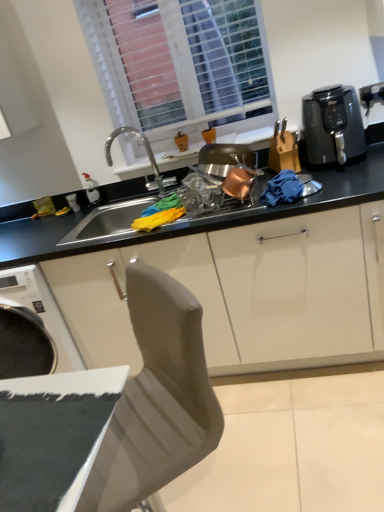
The height and width of the screenshot is (512, 384). In order to click on black plastic air fryer at upper right in this screenshot , I will do `click(332, 126)`.

Find the location of `black matte countertop at center`. black matte countertop at center is located at coordinates (194, 216).

The width and height of the screenshot is (384, 512). I want to click on white plastic window at upper center, so click(x=181, y=63).

Is white plastic window at upper center further to the viewer compared to black plastic air fryer at upper right?

That is True.

How many degrees apart are the facing directions of white plastic window at upper center and black plastic air fryer at upper right?

The angular difference between white plastic window at upper center and black plastic air fryer at upper right is 0.544 degrees.

Is white plastic window at upper center positioned beyond the bounds of black plastic air fryer at upper right?

white plastic window at upper center lies outside black plastic air fryer at upper right's area.

Consider the image. Does white plastic window at upper center have a smaller size compared to black plastic air fryer at upper right?

No, white plastic window at upper center is not smaller than black plastic air fryer at upper right.

Which object is positioned more to the right, black matte countertop at center or black plastic air fryer at upper right?

From the viewer's perspective, black plastic air fryer at upper right appears more on the right side.

Is black matte countertop at center taller or shorter than black plastic air fryer at upper right?

black matte countertop at center is shorter than black plastic air fryer at upper right.

From a real-world perspective, who is located higher, black matte countertop at center or black plastic air fryer at upper right?

In real-world perspective, black plastic air fryer at upper right is above.

Is black plastic air fryer at upper right at the back of black matte countertop at center?

No, black matte countertop at center is not facing the opposite direction of black plastic air fryer at upper right.

Is black plastic knife block at right at the right side of black plastic air fryer at upper right?

No, black plastic knife block at right is not to the right of black plastic air fryer at upper right.

Between black plastic knife block at right and black plastic air fryer at upper right, which one has smaller size?

black plastic knife block at right.

Which of these two, black plastic knife block at right or black plastic air fryer at upper right, stands shorter?

black plastic knife block at right is shorter.

The image size is (384, 512). In the image, there is a black plastic air fryer at upper right. What are the coordinates of `appliance below it (from the image's perspective)` in the screenshot? It's located at (283, 150).

Is white plastic window at upper center wider than black plastic knife block at right?

In fact, white plastic window at upper center might be narrower than black plastic knife block at right.

Can you confirm if white plastic window at upper center is shorter than black plastic knife block at right?

No, white plastic window at upper center is not shorter than black plastic knife block at right.

Considering the positions of point (208, 23) and point (284, 125), is point (208, 23) closer or farther from the camera than point (284, 125)?

Point (208, 23).

Is black plastic knife block at right inside white plastic window at upper center?

That's incorrect, black plastic knife block at right is not inside white plastic window at upper center.

Considering the relative sizes of black matte countertop at center and white plastic window at upper center in the image provided, is black matte countertop at center taller than white plastic window at upper center?

Incorrect, the height of black matte countertop at center is not larger of that of white plastic window at upper center.

From a real-world perspective, is black matte countertop at center positioned above or below white plastic window at upper center?

From a real-world perspective, black matte countertop at center is physically below white plastic window at upper center.

Considering the relative positions of black matte countertop at center and white plastic window at upper center in the image provided, is black matte countertop at center to the right of white plastic window at upper center from the viewer's perspective?

Incorrect, black matte countertop at center is not on the right side of white plastic window at upper center.

From the image's perspective, is black matte countertop at center under white plastic window at upper center?

Indeed, from the image's perspective, black matte countertop at center is shown beneath white plastic window at upper center.

Which is more to the right, white plastic window at upper center or black matte countertop at center?

white plastic window at upper center is more to the right.

From the image's perspective, would you say white plastic window at upper center is positioned over black matte countertop at center?

Yes, from the image's perspective, white plastic window at upper center is on top of black matte countertop at center.

Can you see white plastic window at upper center touching black matte countertop at center?

No, white plastic window at upper center is not making contact with black matte countertop at center.

How different are the orientations of black plastic knife block at right and black matte countertop at center in degrees?

black plastic knife block at right and black matte countertop at center are facing 0.0206 degrees away from each other.

Which is in front, black plastic knife block at right or black matte countertop at center?

black plastic knife block at right is in front.

Which of these two, black plastic knife block at right or black matte countertop at center, is thinner?

black matte countertop at center is thinner.

The height and width of the screenshot is (512, 384). I want to click on kitchen appliance below the white plastic window at upper center (from a real-world perspective), so click(332, 126).

This screenshot has width=384, height=512. I want to click on kitchen appliance that is above the black matte countertop at center (from the image's perspective), so click(x=332, y=126).

Estimate the real-world distances between objects in this image. Which object is closer to black matte countertop at center, black plastic air fryer at upper right or white plastic window at upper center?

black plastic air fryer at upper right is closer to black matte countertop at center.

When comparing their distances from white plastic window at upper center, does black plastic air fryer at upper right or black plastic knife block at right seem further?

black plastic air fryer at upper right is further to white plastic window at upper center.

Which object lies further to the anchor point black matte countertop at center, black plastic knife block at right or white plastic window at upper center?

white plastic window at upper center.

From the image, which object appears to be nearer to black plastic air fryer at upper right, white plastic window at upper center or black plastic knife block at right?

Based on the image, black plastic knife block at right appears to be nearer to black plastic air fryer at upper right.

Considering their positions, is black matte countertop at center positioned further to black plastic knife block at right than white plastic window at upper center?

The object further to black plastic knife block at right is white plastic window at upper center.

When comparing their distances from black plastic knife block at right, does white plastic window at upper center or black matte countertop at center seem further?

Among the two, white plastic window at upper center is located further to black plastic knife block at right.

Which object lies nearer to the anchor point white plastic window at upper center, black matte countertop at center or black plastic air fryer at upper right?

The object closer to white plastic window at upper center is black matte countertop at center.

In the scene shown: Considering their positions, is black plastic air fryer at upper right positioned closer to white plastic window at upper center than black matte countertop at center?

Based on the image, black matte countertop at center appears to be nearer to white plastic window at upper center.

The image size is (384, 512). I want to click on appliance between black matte countertop at center and black plastic air fryer at upper right from left to right, so click(x=283, y=150).

Where is `appliance between white plastic window at upper center and black plastic air fryer at upper right from left to right`? The width and height of the screenshot is (384, 512). appliance between white plastic window at upper center and black plastic air fryer at upper right from left to right is located at coordinates 283,150.

Image resolution: width=384 pixels, height=512 pixels. I want to click on window between black matte countertop at center and black plastic air fryer at upper right, so click(181, 63).

Locate an element on the screen. appliance between white plastic window at upper center and black matte countertop at center vertically is located at coordinates (283, 150).